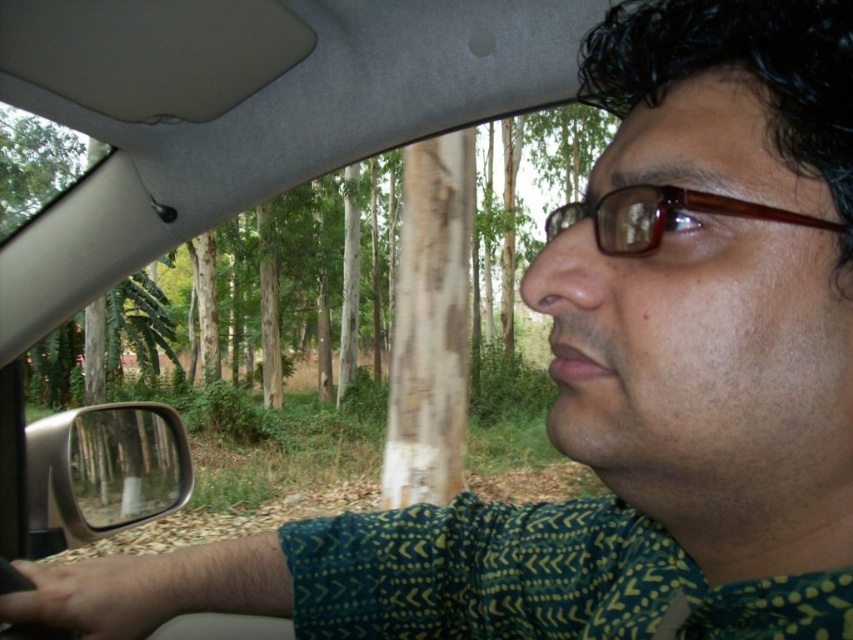
You are a passenger in the car and want to check your reflection. The clear plastic mirror at left and brown plastic glasses at upper center are both in your line of sight. Which object could potentially provide a wider view for checking your reflection?

The clear plastic mirror at left might be wider than brown plastic glasses at upper center, so it could potentially provide a wider view for checking your reflection.

You are a passenger in the car and want to check your reflection. Which object, the clear plastic mirror at left or the brown plastic glasses at upper center, is located to the left of the other?

The clear plastic mirror at left is positioned on the left side of brown plastic glasses at upper center, so the clear plastic mirror at left is to the left of the brown plastic glasses at upper center.

You are a passenger in the car and want to check the rearview mirror. Which object is positioned lower and closer to your knees between the clear plastic mirror at left and the brown plastic glasses at upper center?

The clear plastic mirror at left is located below the brown plastic glasses at upper center, so it is positioned lower and closer to your knees.